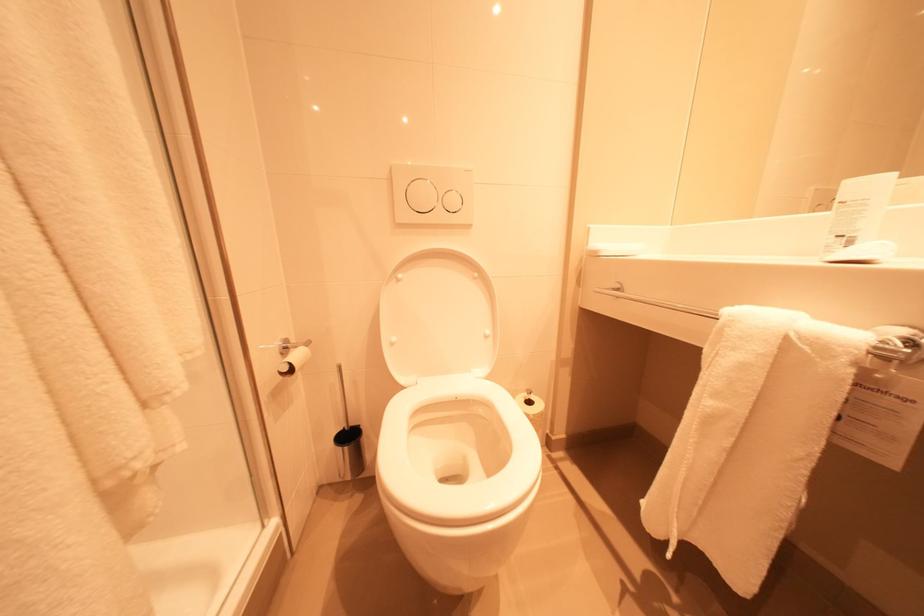
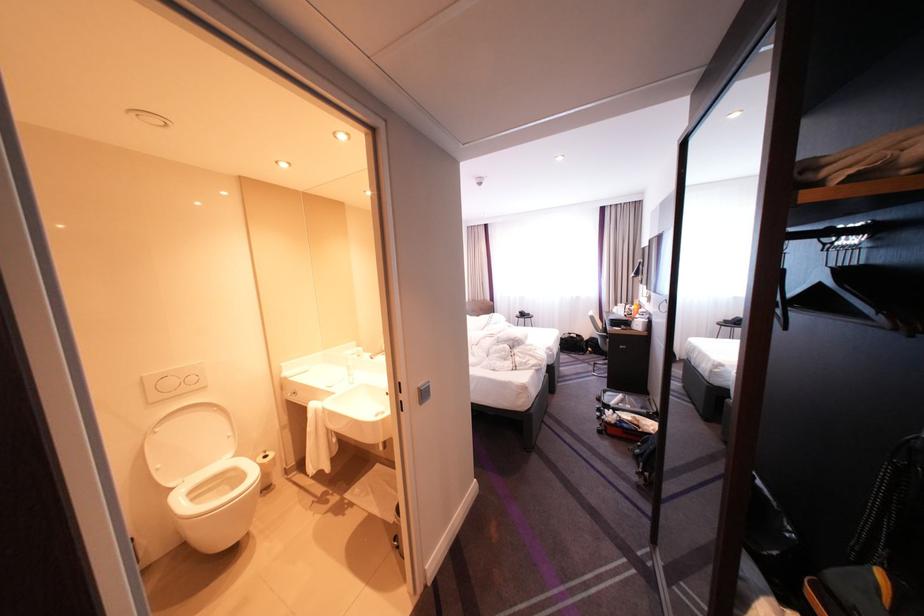
Where in the second image is the point corresponding to point 412,381 from the first image?

(183, 485)